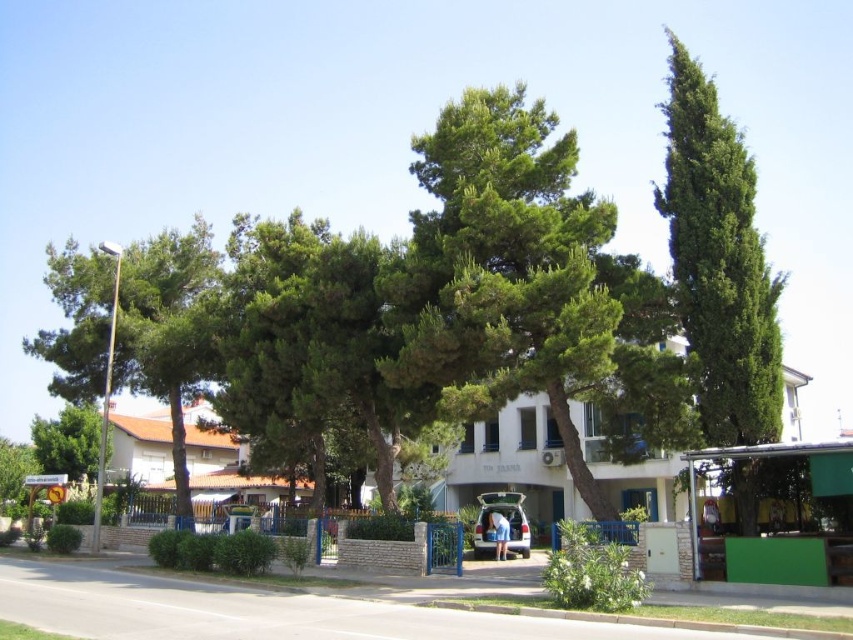
You are standing at the center of the road in the residential area. You see a green coniferous tree at right and a green leafy tree at left. Which tree is positioned farther to the east?

The green coniferous tree at right is positioned farther to the east because it is located to the right of the green leafy tree at left.

Based on the photo, you are a gardener planning to plant a new tree in the garden. The green coniferous tree at right and the green leafy tree at lower left are already present. Which of these two trees is taller?

The green coniferous tree at right is taller than the green leafy tree at lower left.